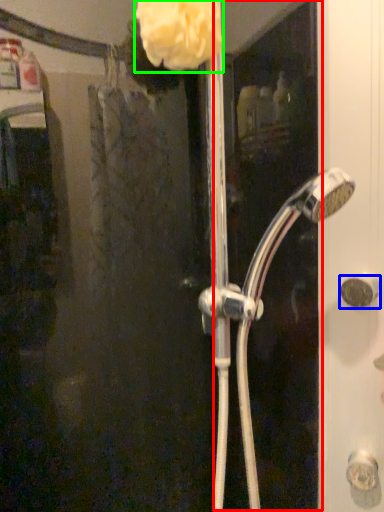
Question: Which is nearer to the screen door (highlighted by a red box)? door handle (highlighted by a blue box) or flower (highlighted by a green box).

Choices:
 (A) door handle
 (B) flower

Answer: (A)